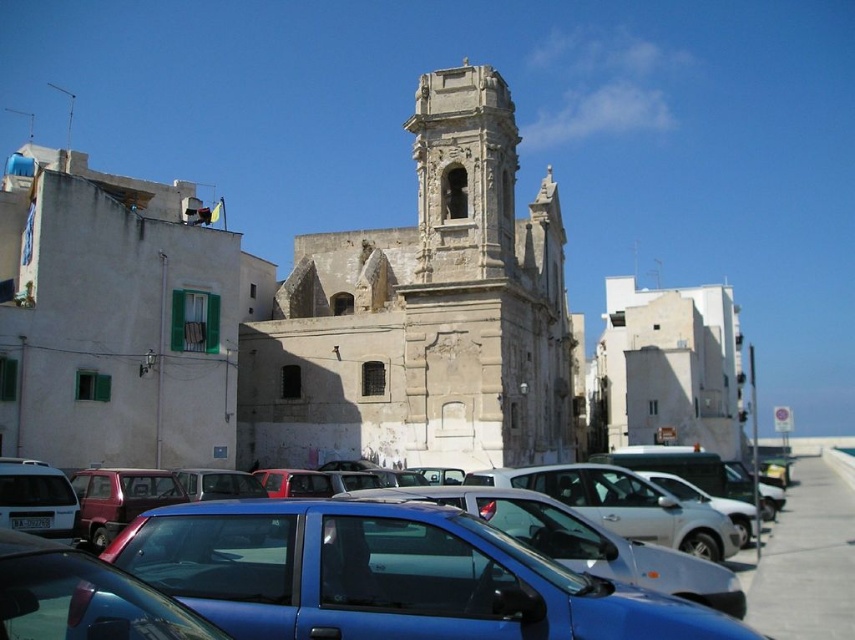
Can you confirm if white stone church at center is taller than metallic blue sedan at center?

→ Yes.

Which is in front, point (503, 310) or point (316, 576)?

Point (316, 576) is more forward.

The image size is (855, 640). In order to click on white stone church at center in this screenshot , I will do `click(423, 314)`.

Image resolution: width=855 pixels, height=640 pixels. Describe the element at coordinates (423, 314) in the screenshot. I see `white stone church at center` at that location.

Which is more to the right, white stone church at center or white concrete building at center?

white concrete building at center

Does point (476, 182) come farther from viewer compared to point (641, 424)?

No.

The width and height of the screenshot is (855, 640). Identify the location of white stone church at center. (423, 314).

Does metallic blue sedan at center come in front of white concrete building at center?

Yes, it is.

Can you confirm if metallic blue sedan at center is positioned below white concrete building at center?

Indeed, metallic blue sedan at center is positioned under white concrete building at center.

Is point (156, 554) positioned after point (603, 314)?

No.

Identify the location of metallic blue sedan at center. (416, 572).